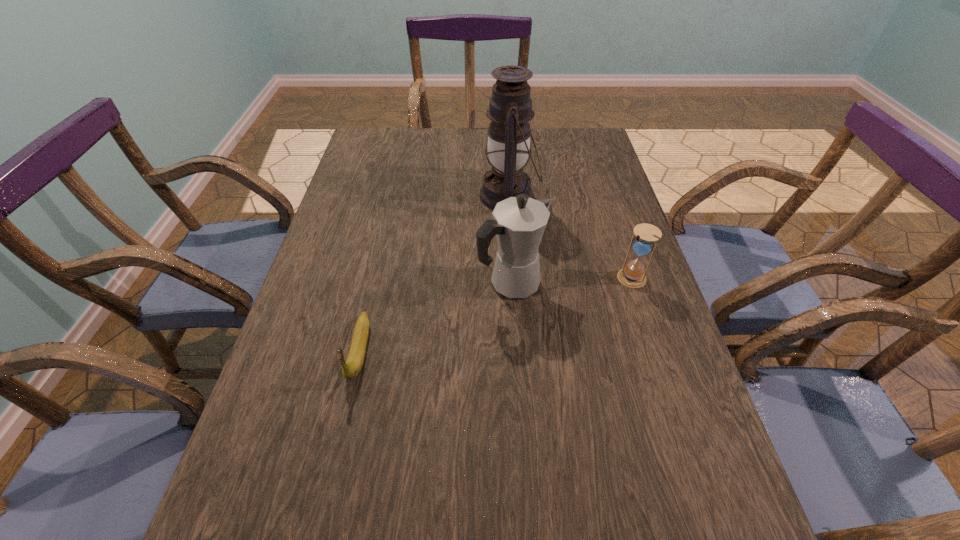
This screenshot has height=540, width=960. In order to click on the farthest object in this screenshot , I will do `click(510, 109)`.

Where is `the tallest object`? This screenshot has width=960, height=540. the tallest object is located at coordinates (510, 109).

Locate an element on the screen. coffeepot is located at coordinates [519, 222].

Locate an element on the screen. the rightmost object is located at coordinates (632, 275).

Find the location of a particular element. hourglass is located at coordinates (632, 275).

This screenshot has width=960, height=540. I want to click on the shortest object, so click(351, 368).

Locate an element on the screen. This screenshot has width=960, height=540. the leftmost object is located at coordinates (351, 368).

In order to click on free region located on the left of the tallest object in this screenshot , I will do `click(431, 195)`.

Locate an element on the screen. free space located on the back of the coffeepot is located at coordinates (507, 219).

This screenshot has height=540, width=960. What are the coordinates of `free space located on the back of the hourglass` in the screenshot? It's located at (605, 197).